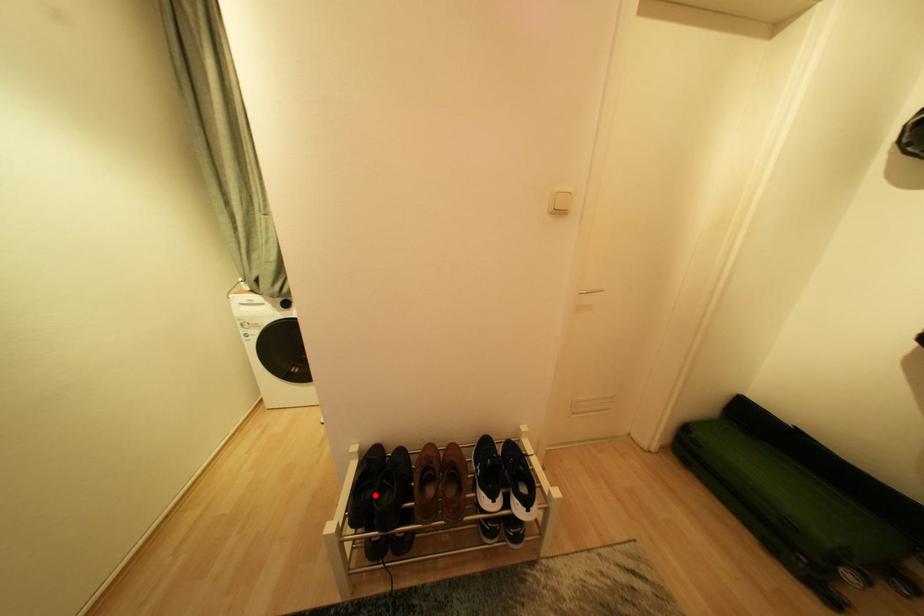
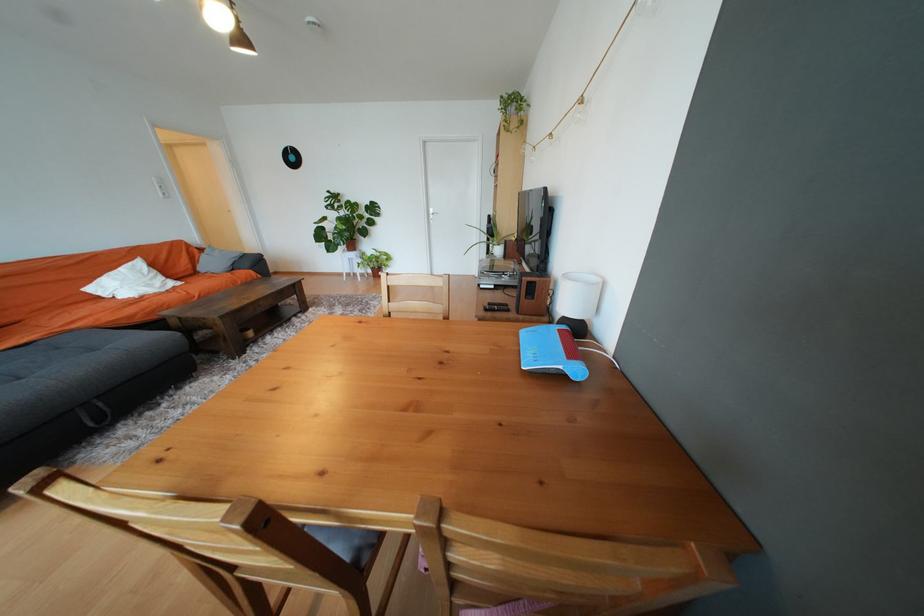
Question: I am providing you with two images of the same scene from different viewpoints. A red point is marked on the first image. Can you still see the location of the red point in image 2?

Choices:
 (A) Yes
 (B) No

Answer: (B)